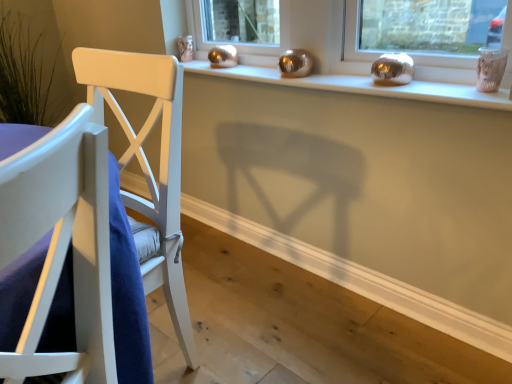
Question: Is white wood chair at left positioned far away from satin gold ornaments at upper center?

Choices:
 (A) no
 (B) yes

Answer: (A)

Question: Considering the relative sizes of white wood chair at left and satin gold ornaments at upper center in the image provided, is white wood chair at left thinner than satin gold ornaments at upper center?

Choices:
 (A) no
 (B) yes

Answer: (A)

Question: Is the surface of white wood chair at left in direct contact with satin gold ornaments at upper center?

Choices:
 (A) no
 (B) yes

Answer: (A)

Question: From a real-world perspective, is white wood chair at left below satin gold ornaments at upper center?

Choices:
 (A) yes
 (B) no

Answer: (A)

Question: Can you confirm if white wood chair at left is positioned to the right of satin gold ornaments at upper center?

Choices:
 (A) no
 (B) yes

Answer: (A)

Question: Is satin gold ornaments at upper center surrounded by white wood chair at left?

Choices:
 (A) no
 (B) yes

Answer: (A)

Question: Can you see satin gold ornaments at upper center touching white wood chair at left?

Choices:
 (A) no
 (B) yes

Answer: (A)

Question: From the image's perspective, would you say satin gold ornaments at upper center is shown under white wood chair at left?

Choices:
 (A) no
 (B) yes

Answer: (A)

Question: Is satin gold ornaments at upper center positioned with its back to white wood chair at left?

Choices:
 (A) yes
 (B) no

Answer: (B)

Question: Does satin gold ornaments at upper center have a smaller size compared to white wood chair at left?

Choices:
 (A) no
 (B) yes

Answer: (B)

Question: Does satin gold ornaments at upper center appear on the left side of white wood chair at left?

Choices:
 (A) yes
 (B) no

Answer: (B)

Question: Considering the relative positions of satin gold ornaments at upper center and white wood chair at left in the image provided, is satin gold ornaments at upper center to the right of white wood chair at left from the viewer's perspective?

Choices:
 (A) yes
 (B) no

Answer: (A)

Question: Is white wood chair at left in front of or behind satin gold ornaments at upper center in the image?

Choices:
 (A) behind
 (B) front

Answer: (B)